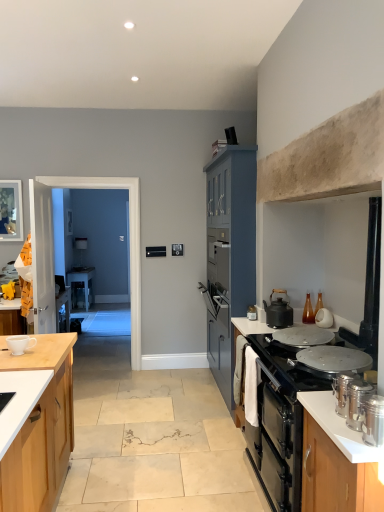
Identify the location of matte black kettle at right, placed as the 1th kitchen appliance when sorted from back to front. Image resolution: width=384 pixels, height=512 pixels. (252, 313).

How much space does satin silver canisters at right, placed as the 3th kitchen appliance when sorted from back to front, occupy vertically?

The height of satin silver canisters at right, placed as the 3th kitchen appliance when sorted from back to front, is 7.69 inches.

Locate an element on the screen. Image resolution: width=384 pixels, height=512 pixels. matte blue cabinet at center, the 1th cabinetry when ordered from back to front is located at coordinates (230, 253).

Locate an element on the screen. The height and width of the screenshot is (512, 384). silver metallic canisters at lower right, the first cabinetry positioned from the front is located at coordinates (335, 476).

I want to click on wooden picture frame at left, so click(x=11, y=210).

Who is taller, satin silver canisters at right, placed as the 3th kitchen appliance when sorted from back to front, or matte black kettle at right, placed as the 1th kitchen appliance when sorted from back to front?

satin silver canisters at right, placed as the 3th kitchen appliance when sorted from back to front.

Are satin silver canisters at right, placed as the 3th kitchen appliance when sorted from back to front, and matte black kettle at right, placed as the 1th kitchen appliance when sorted from back to front, making contact?

No, satin silver canisters at right, placed as the 3th kitchen appliance when sorted from back to front, is not beside matte black kettle at right, placed as the 1th kitchen appliance when sorted from back to front.

Is satin silver canisters at right, the 2th kitchen appliance when ordered from front to back, closer to the viewer compared to matte black kettle at right, placed as the 1th kitchen appliance when sorted from back to front?

Yes, satin silver canisters at right, the 2th kitchen appliance when ordered from front to back, is closer to the camera.

From a real-world perspective, relative to silver metallic canisters at lower right, the first cabinetry positioned from the front, is black glass cooktop at right vertically above or below?

black glass cooktop at right is above silver metallic canisters at lower right, the first cabinetry positioned from the front.

Is black glass cooktop at right oriented towards silver metallic canisters at lower right, placed as the 2th cabinetry when sorted from back to front?

No, black glass cooktop at right is not turned towards silver metallic canisters at lower right, placed as the 2th cabinetry when sorted from back to front.

Considering the relative positions of black glass cooktop at right and silver metallic canisters at lower right, the first cabinetry positioned from the front, in the image provided, is black glass cooktop at right to the right of silver metallic canisters at lower right, the first cabinetry positioned from the front, from the viewer's perspective?

Yes.

Can you confirm if black glass cooktop at right is taller than silver metallic canisters at lower right, the first cabinetry positioned from the front?

No, black glass cooktop at right is not taller than silver metallic canisters at lower right, the first cabinetry positioned from the front.

Is matte black kettle at right, the third kitchen appliance positioned from the front, facing away from wooden picture frame at left?

No, wooden picture frame at left is not at the back of matte black kettle at right, the third kitchen appliance positioned from the front.

Is matte black kettle at right, the third kitchen appliance positioned from the front, not inside wooden picture frame at left?

Indeed, matte black kettle at right, the third kitchen appliance positioned from the front, is completely outside wooden picture frame at left.

Locate an element on the screen. This screenshot has height=512, width=384. picture frame above the matte black kettle at right, the third kitchen appliance positioned from the front (from a real-world perspective) is located at coordinates (x=11, y=210).

How far apart are matte black kettle at right, the third kitchen appliance positioned from the front, and wooden picture frame at left?

matte black kettle at right, the third kitchen appliance positioned from the front, and wooden picture frame at left are 2.92 meters apart from each other.

Find the location of a particular element. The width and height of the screenshot is (384, 512). kitchen appliance that is the 1st one when counting rightward from the satin silver canisters at right, the 2th kitchen appliance when ordered from front to back is located at coordinates (373, 420).

Based on their sizes in the image, would you say satin silver canisters at right, placed as the 3th kitchen appliance when sorted from back to front, is bigger or smaller than satin silver canisters at right, which is counted as the 1th kitchen appliance, starting from the front?

Considering their sizes, satin silver canisters at right, placed as the 3th kitchen appliance when sorted from back to front, takes up more space than satin silver canisters at right, which is counted as the 1th kitchen appliance, starting from the front.

Is satin silver canisters at right, placed as the 3th kitchen appliance when sorted from back to front, not within satin silver canisters at right, the 4th kitchen appliance viewed from the back?

Indeed, satin silver canisters at right, placed as the 3th kitchen appliance when sorted from back to front, is completely outside satin silver canisters at right, the 4th kitchen appliance viewed from the back.

Is satin silver canisters at right, the 2th kitchen appliance when ordered from front to back, facing away from satin silver canisters at right, the 4th kitchen appliance viewed from the back?

That's not correct — satin silver canisters at right, the 2th kitchen appliance when ordered from front to back, is not looking away from satin silver canisters at right, the 4th kitchen appliance viewed from the back.

From the picture: From a real-world perspective, is matte black kettle at right, placed as the 1th kitchen appliance when sorted from back to front, located beneath white ceramic cup at left?

Yes, from a real-world perspective, matte black kettle at right, placed as the 1th kitchen appliance when sorted from back to front, is below white ceramic cup at left.

In terms of size, does matte black kettle at right, placed as the 1th kitchen appliance when sorted from back to front, appear bigger or smaller than white ceramic cup at left?

matte black kettle at right, placed as the 1th kitchen appliance when sorted from back to front, is smaller than white ceramic cup at left.

Does matte black kettle at right, the fourth kitchen appliance from the front, come in front of white ceramic cup at left?

No, the depth of matte black kettle at right, the fourth kitchen appliance from the front, is greater than that of white ceramic cup at left.

Is satin silver canisters at right, placed as the 3th kitchen appliance when sorted from back to front, thinner than matte black pot/pan at center?

Yes, satin silver canisters at right, placed as the 3th kitchen appliance when sorted from back to front, is thinner than matte black pot/pan at center.

Could you tell me if satin silver canisters at right, placed as the 3th kitchen appliance when sorted from back to front, is turned towards matte black pot/pan at center?

No, satin silver canisters at right, placed as the 3th kitchen appliance when sorted from back to front, does not turn towards matte black pot/pan at center.

Considering the positions of points (338, 376) and (284, 345), is point (338, 376) farther from camera compared to point (284, 345)?

No, (338, 376) is closer to viewer.

Who is shorter, satin silver canisters at right, placed as the 3th kitchen appliance when sorted from back to front, or matte black pot/pan at center?

With less height is matte black pot/pan at center.

Find the location of a particular element. This screenshot has width=384, height=512. the 1st glass door behind when counting from the silver metallic canisters at right, acting as the second countertop starting from the bottom is located at coordinates (42, 257).

Considering the sizes of objects transparent glass door at left, placed as the first glass door when sorted from front to back, and silver metallic canisters at right, which is counted as the first countertop, starting from the top, in the image provided, who is smaller, transparent glass door at left, placed as the first glass door when sorted from front to back, or silver metallic canisters at right, which is counted as the first countertop, starting from the top,?

silver metallic canisters at right, which is counted as the first countertop, starting from the top, is smaller.

How many degrees apart are the facing directions of transparent glass door at left, placed as the first glass door when sorted from front to back, and silver metallic canisters at right, which is counted as the first countertop, starting from the top?

There is a 177-degree angle between the facing directions of transparent glass door at left, placed as the first glass door when sorted from front to back, and silver metallic canisters at right, which is counted as the first countertop, starting from the top.

Considering the positions of objects transparent glass door at left, the 2th glass door in the back-to-front sequence, and silver metallic canisters at right, acting as the second countertop starting from the bottom, in the image provided, who is more to the left, transparent glass door at left, the 2th glass door in the back-to-front sequence, or silver metallic canisters at right, acting as the second countertop starting from the bottom,?

transparent glass door at left, the 2th glass door in the back-to-front sequence.

From the satin silver canisters at right, the 2th kitchen appliance when ordered from front to back, count 2nd kitchen appliances backward and point to it. Please provide its 2D coordinates.

[(252, 313)]

There is a silver metallic canisters at lower right, placed as the 2th cabinetry when sorted from back to front. Where is `gas stove above it (from a real-world perspective)`? gas stove above it (from a real-world perspective) is located at coordinates click(x=290, y=366).

From the image, which object appears to be farther from silver metallic canisters at lower right, the first cabinetry positioned from the front, matte black desk at center or black plastic phone at upper center?

The object further to silver metallic canisters at lower right, the first cabinetry positioned from the front, is matte black desk at center.

Estimate the real-world distances between objects in this image. Which object is closer to matte black desk at center, white glossy countertop at right, which is counted as the first countertop, starting from the back, or matte black pot/pan at center?

Based on the image, matte black pot/pan at center appears to be nearer to matte black desk at center.

Looking at the image, which one is located further to white glossy coffee maker at upper center, black plastic phone at upper center or matte black kettle at right, the fourth kitchen appliance from the front?

Among the two, matte black kettle at right, the fourth kitchen appliance from the front, is located further to white glossy coffee maker at upper center.

When comparing their distances from transparent glass door at center, the 2th glass door when ordered from front to back, does white glossy countertop at right, acting as the second countertop starting from the top, or matte black kettle at right, the third kitchen appliance positioned from the front, seem closer?

Based on the image, matte black kettle at right, the third kitchen appliance positioned from the front, appears to be nearer to transparent glass door at center, the 2th glass door when ordered from front to back.

Based on their spatial positions, is white glossy coffee maker at upper center or matte blue cabinet at center, which is counted as the 2th cabinetry, starting from the front, further from satin silver canisters at right, placed as the 3th kitchen appliance when sorted from back to front?

white glossy coffee maker at upper center is positioned further to the anchor satin silver canisters at right, placed as the 3th kitchen appliance when sorted from back to front.

Considering their positions, is transparent glass door at left, the 2th glass door in the back-to-front sequence, positioned closer to black plastic phone at upper center than silver metallic canisters at lower right, the first cabinetry positioned from the front?

The object closer to black plastic phone at upper center is transparent glass door at left, the 2th glass door in the back-to-front sequence.

Based on their spatial positions, is black glass cooktop at right or matte black kettle at right, the third kitchen appliance positioned from the front, closer to transparent glass door at left, placed as the first glass door when sorted from front to back?

matte black kettle at right, the third kitchen appliance positioned from the front, is positioned closer to the anchor transparent glass door at left, placed as the first glass door when sorted from front to back.

Based on their spatial positions, is white ceramic cup at left or matte black kettle at right, the third kitchen appliance positioned from the front, further from wooden picture frame at left?

matte black kettle at right, the third kitchen appliance positioned from the front, lies further to wooden picture frame at left than the other object.

Locate an element on the screen. glass door located between wooden picture frame at left and white glossy coffee maker at upper center in the depth direction is located at coordinates (52, 247).

In order to click on corded phone between silver metallic canisters at right, which is counted as the first countertop, starting from the front, and transparent glass door at left, placed as the first glass door when sorted from front to back, along the z-axis in this screenshot , I will do `click(231, 136)`.

At what (x,y) coordinates should I click in order to perform the action: click on kitchen appliance between matte black kettle at right, the third kitchen appliance positioned from the front, and white glossy coffee maker at upper center in the front-back direction. Please return your answer as a coordinate pair (x, y). The height and width of the screenshot is (512, 384). Looking at the image, I should click on (252, 313).

This screenshot has height=512, width=384. I want to click on glass door between satin silver canisters at right, the 4th kitchen appliance viewed from the back, and wooden picture frame at left, along the z-axis, so click(42, 257).